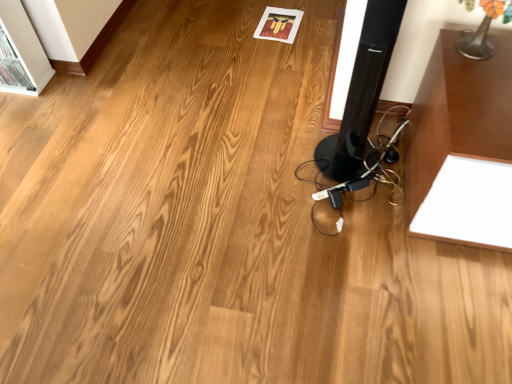
At what (x,y) coordinates should I click in order to perform the action: click on vacant area that is in front of black glossy speaker at center. Please return your answer as a coordinate pair (x, y). The width and height of the screenshot is (512, 384). Looking at the image, I should click on (354, 213).